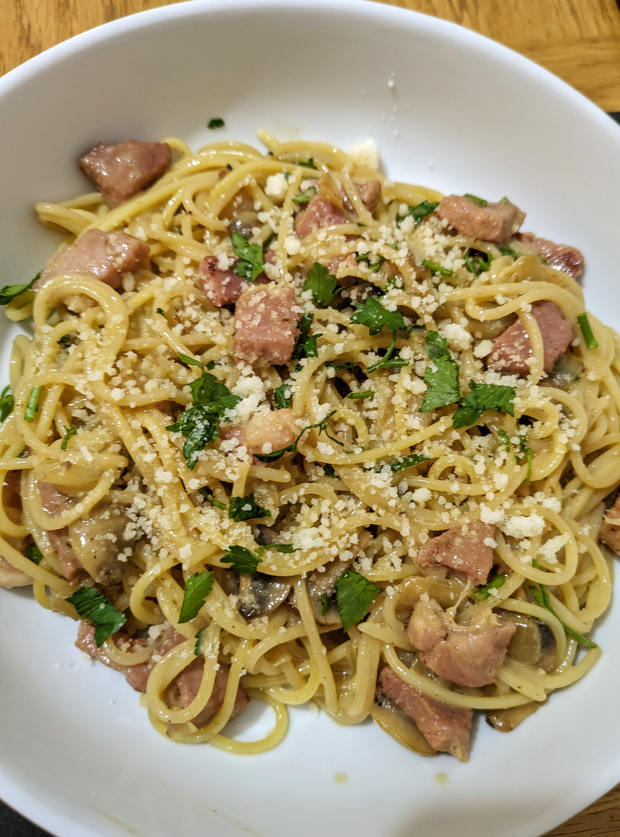
I want to click on bowl, so click(x=523, y=105).